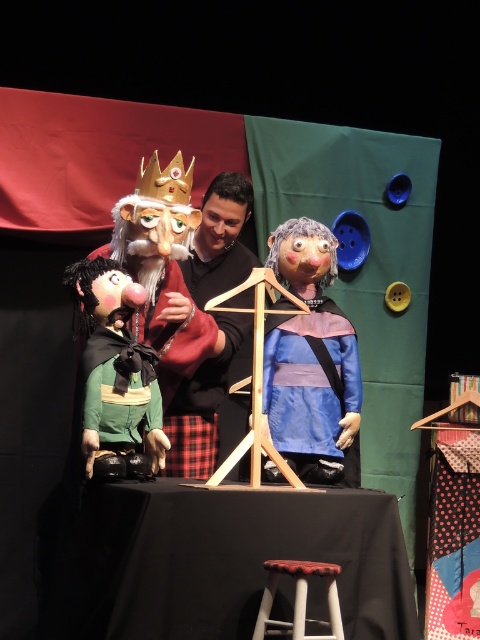
Which is more to the left, matte green fabric puppet at left or matte green fabric doll at left?

Positioned to the left is matte green fabric doll at left.

Where is `matte green fabric puppet at left`? The height and width of the screenshot is (640, 480). matte green fabric puppet at left is located at coordinates (163, 269).

Between point (178, 157) and point (96, 403), which one is positioned behind?

The point (178, 157) is behind.

Identify the location of matte green fabric puppet at left. This screenshot has height=640, width=480. (163, 269).

Is matte green fabric doll at left bigger than black matte shirt at center?

No, matte green fabric doll at left is not bigger than black matte shirt at center.

Can you confirm if matte green fabric doll at left is shorter than black matte shirt at center?

Yes, matte green fabric doll at left is shorter than black matte shirt at center.

Does point (107, 465) lie in front of point (222, 282)?

Yes, it is.

I want to click on matte green fabric doll at left, so click(x=116, y=372).

Based on the photo, who is more distant from viewer, [304,465] or [95,268]?

Positioned behind is point [304,465].

Image resolution: width=480 pixels, height=640 pixels. Describe the element at coordinates (312, 388) in the screenshot. I see `blue matte dress at center` at that location.

Is point (336, 316) positioned before point (115, 451)?

No, it is behind (115, 451).

The image size is (480, 640). What are the coordinates of `blue matte dress at center` in the screenshot? It's located at (312, 388).